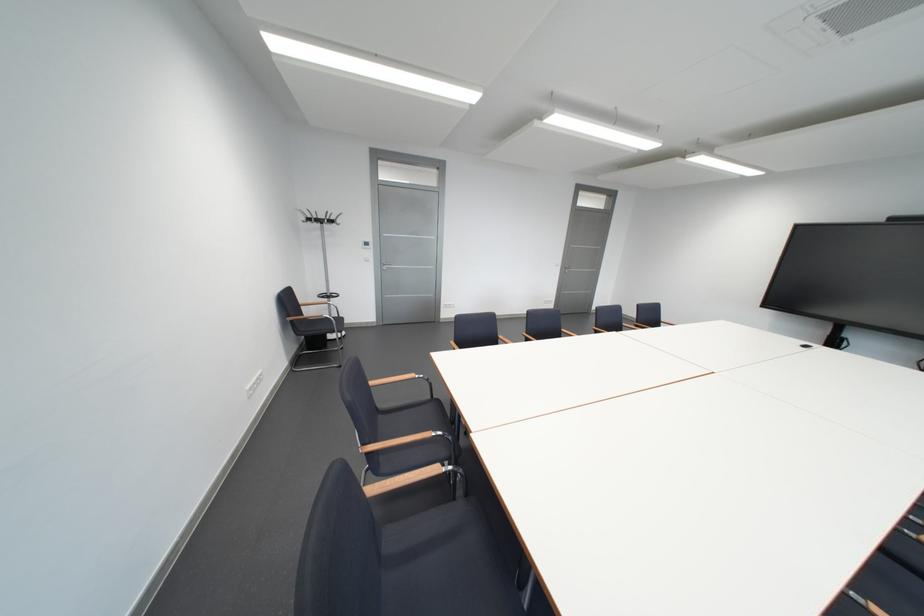
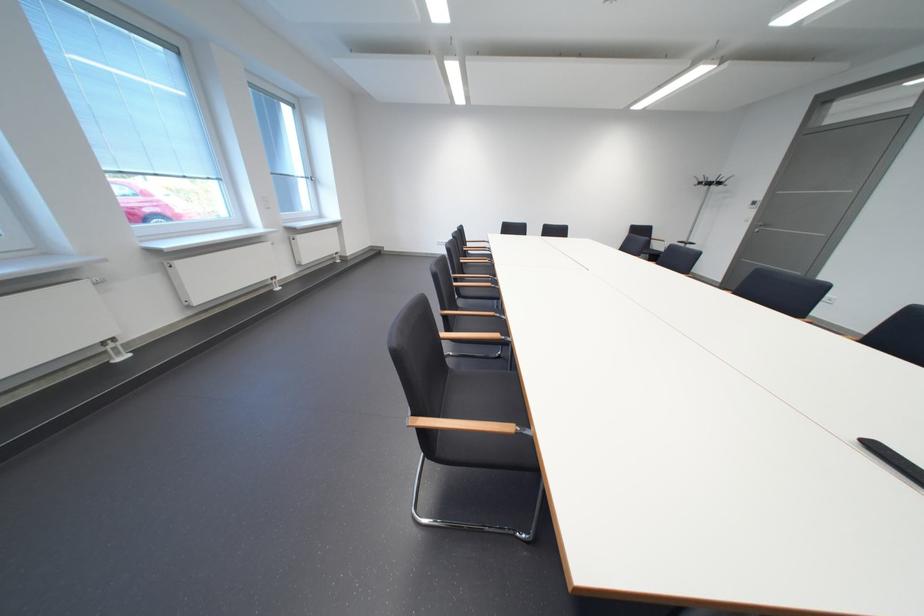
The point at (x=345, y=224) is marked in the first image. Where is the corresponding point in the second image?

(723, 185)